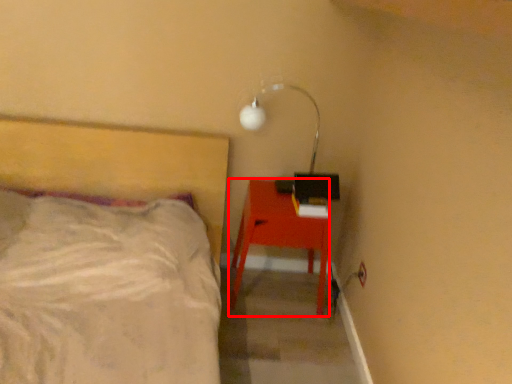
Question: From the image's perspective, where is desk (annotated by the red box) located relative to lamp?

Choices:
 (A) below
 (B) above

Answer: (A)